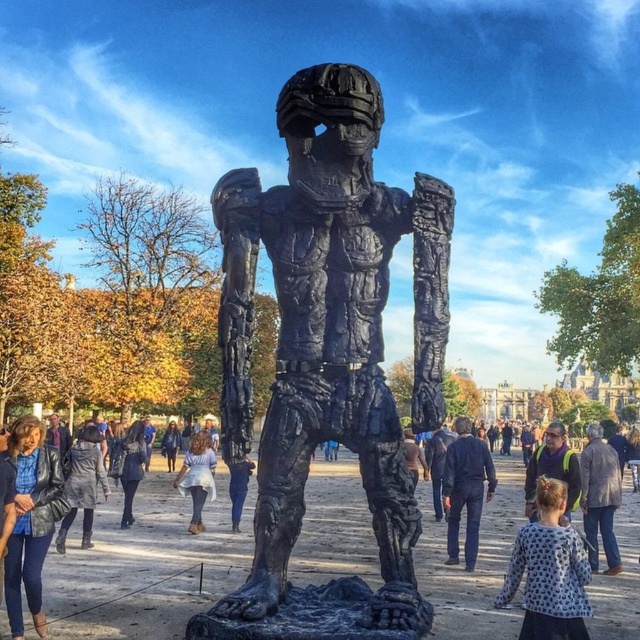
You are standing at the camera position and want to take a photo of the black matte sculpture at center. If your camera has a maximum zoom range of 100 feet, can you capture the sculpture without moving closer?

The black matte sculpture at center and camera are 120.96 feet apart from each other. Since the maximum zoom is 100 feet, you cannot capture the sculpture without moving closer.

You are standing at the center of the public square where the statue is located. You need to place a small decorative pot exactly at the same position as the white dotted shirt at lower right. What are the coordinates where you should place the pot?

You should place the pot at coordinates point (548, 570), which is the exact position of the white dotted shirt at lower right.